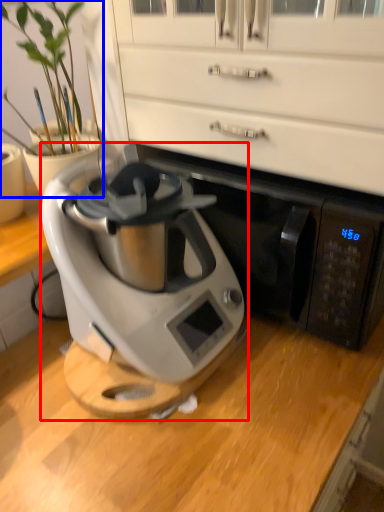
Question: Which object appears farthest to the camera in this image, home appliance (highlighted by a red box) or houseplant (highlighted by a blue box)?

Choices:
 (A) home appliance
 (B) houseplant

Answer: (B)